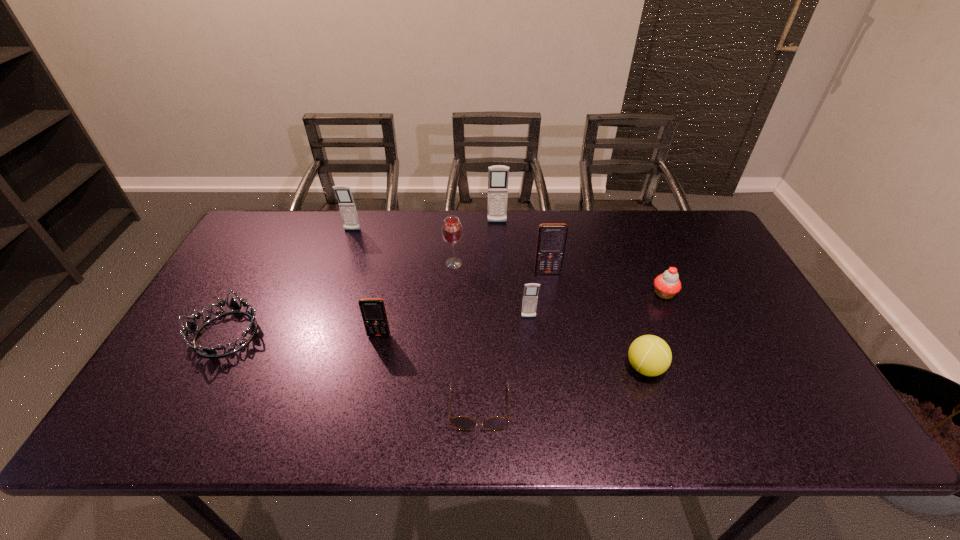
Identify the location of gray cellular telephone that is the closest one to the red wineglass. Image resolution: width=960 pixels, height=540 pixels. (498, 175).

At what (x,y) coordinates should I click in order to perform the action: click on gray cellular telephone that is the nearest to the third nearest cellular telephone. Please return your answer as a coordinate pair (x, y). Looking at the image, I should click on (530, 296).

Image resolution: width=960 pixels, height=540 pixels. Find the location of `vacant region that satisfies the following two spatial constraints: 1. on the screen of the tennis ball; 2. on the left side of the third nearest cellular telephone`. vacant region that satisfies the following two spatial constraints: 1. on the screen of the tennis ball; 2. on the left side of the third nearest cellular telephone is located at coordinates (563, 368).

This screenshot has height=540, width=960. In order to click on free space that satisfies the following two spatial constraints: 1. on the front-facing side of the tennis ball; 2. on the left side of the farthest gray cellular telephone in this screenshot , I will do `click(504, 368)`.